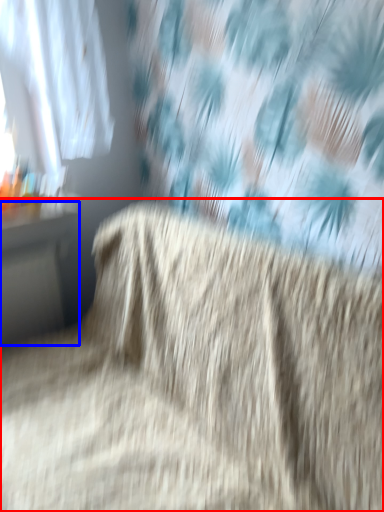
Question: Which object appears farthest to the camera in this image, furniture (highlighted by a red box) or table (highlighted by a blue box)?

Choices:
 (A) furniture
 (B) table

Answer: (B)